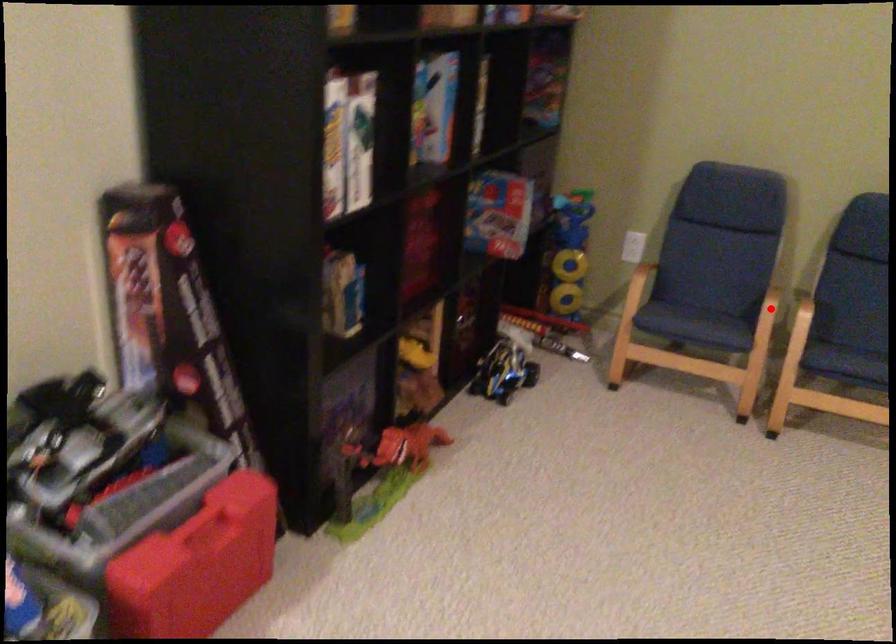
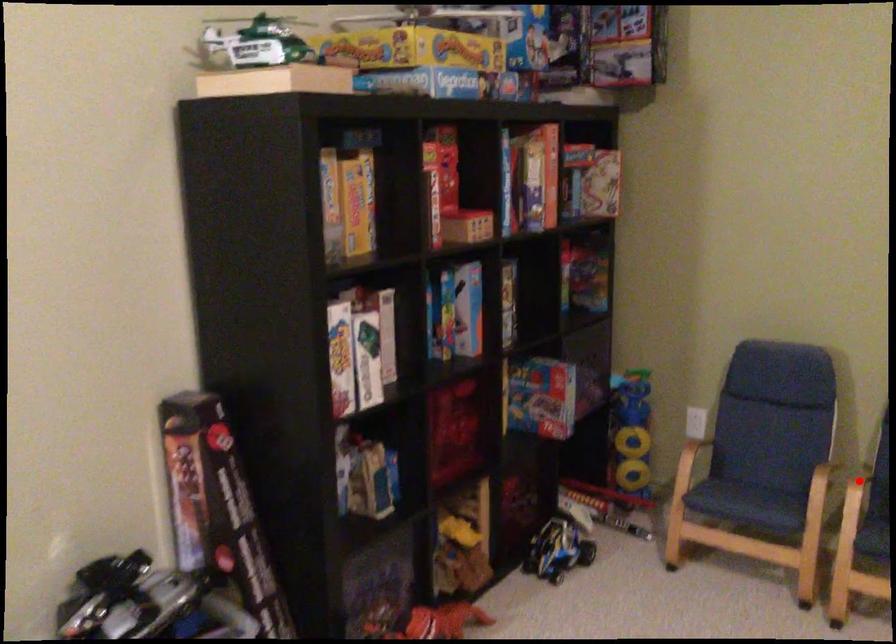
I am providing you with two images of the same scene from different viewpoints. A red point is marked on the first image and another point is marked on the second image. Is the red point in image1 aligned with the point shown in image2?

No